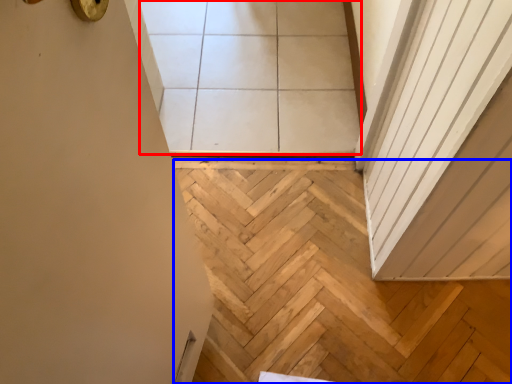
Question: Which of the following is the farthest to the observer, tile (highlighted by a red box) or stairwell (highlighted by a blue box)?

Choices:
 (A) tile
 (B) stairwell

Answer: (A)